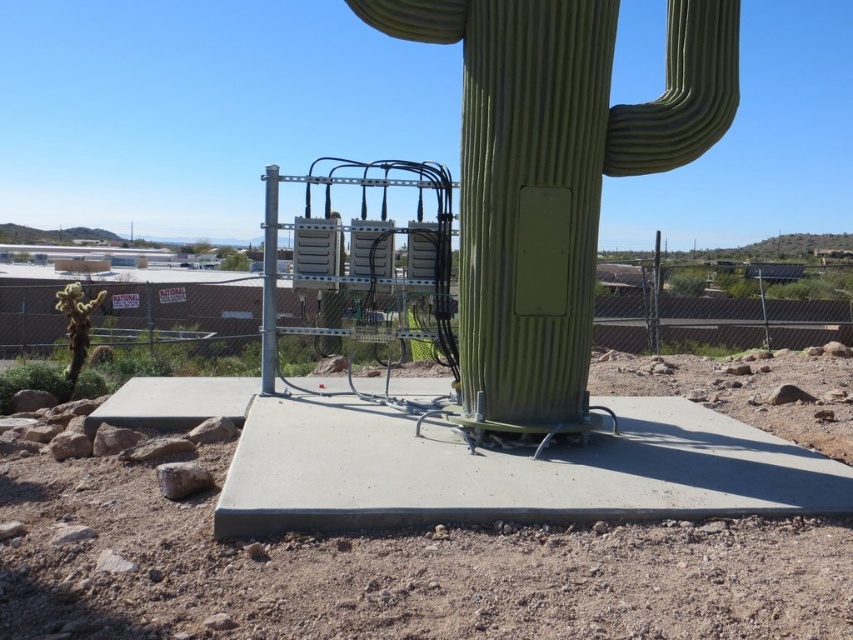
Question: Can you confirm if green matte cactus at center is positioned to the left of metallic gray pole at center?

Choices:
 (A) no
 (B) yes

Answer: (A)

Question: Which of the following is the farthest from the observer?

Choices:
 (A) (74, 288)
 (B) (550, 12)

Answer: (A)

Question: Is metallic gray pole at center closer to the viewer compared to green matte cactus at lower left?

Choices:
 (A) no
 (B) yes

Answer: (B)

Question: Considering the real-world distances, which object is farthest from the green matte cactus at center?

Choices:
 (A) metallic gray pole at center
 (B) green matte cactus at lower left

Answer: (B)

Question: Does metallic gray pole at center appear on the right side of green matte cactus at lower left?

Choices:
 (A) yes
 (B) no

Answer: (A)

Question: Which of the following is the farthest from the observer?

Choices:
 (A) green matte cactus at center
 (B) green matte cactus at lower left

Answer: (B)